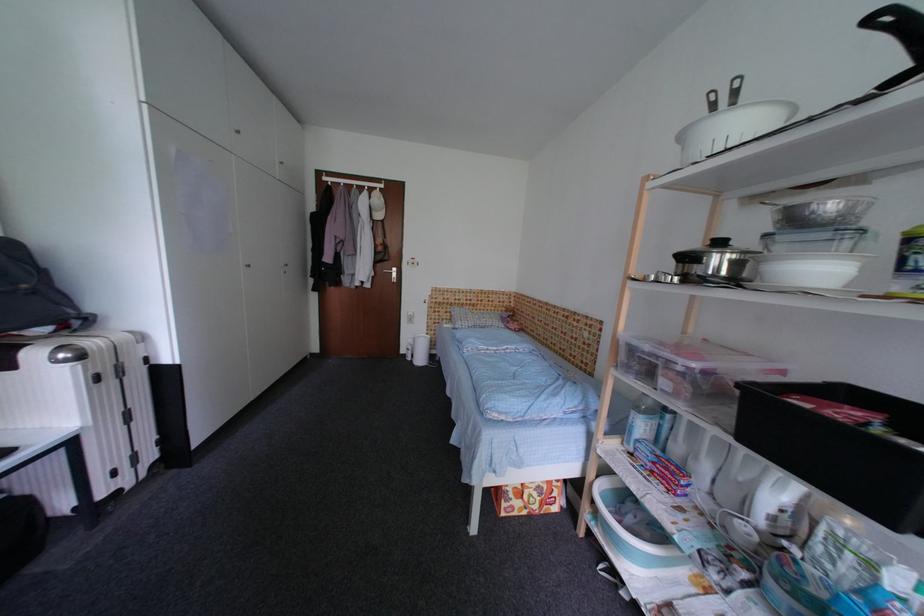
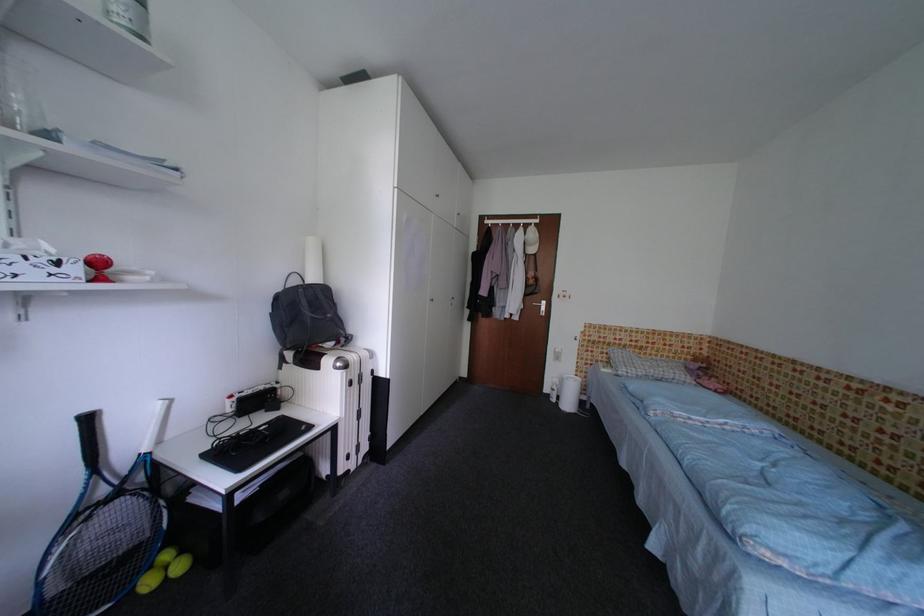
Locate, in the second image, the point that corresponds to (x=499, y=313) in the first image.

(675, 360)